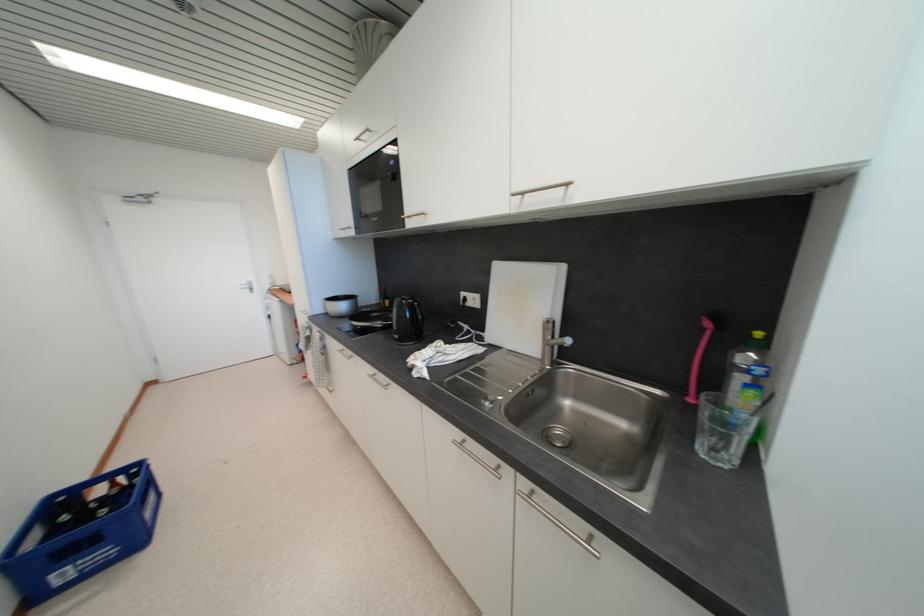
Image resolution: width=924 pixels, height=616 pixels. What do you see at coordinates (570, 351) in the screenshot? I see `the faucet handle` at bounding box center [570, 351].